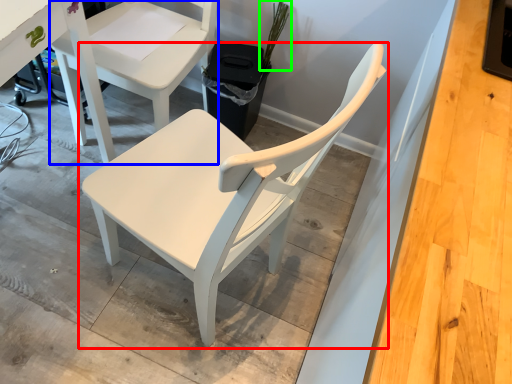
Question: Based on their relative distances, which object is nearer to chair (highlighted by a red box)? Choose from chair (highlighted by a blue box) and plant (highlighted by a green box).

Choices:
 (A) chair
 (B) plant

Answer: (A)